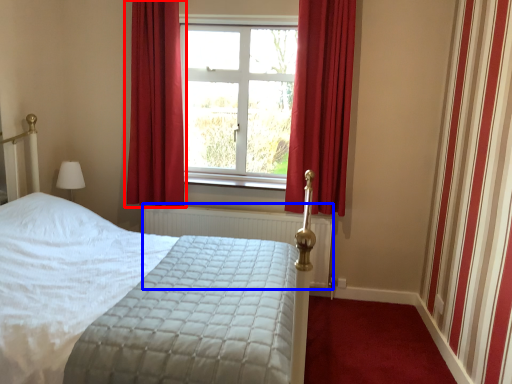
Question: Which object appears closest to the camera in this image, curtain (highlighted by a red box) or radiator (highlighted by a blue box)?

Choices:
 (A) curtain
 (B) radiator

Answer: (A)